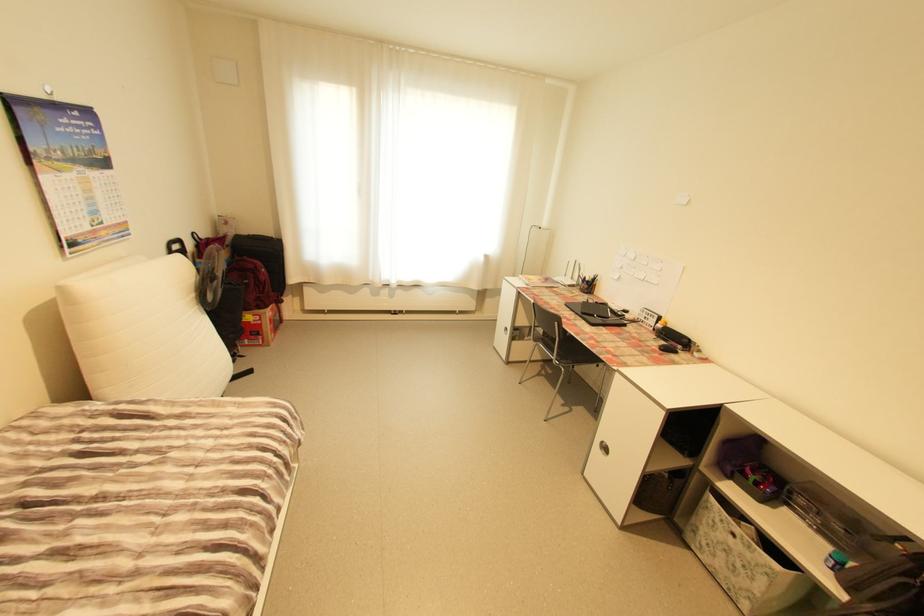
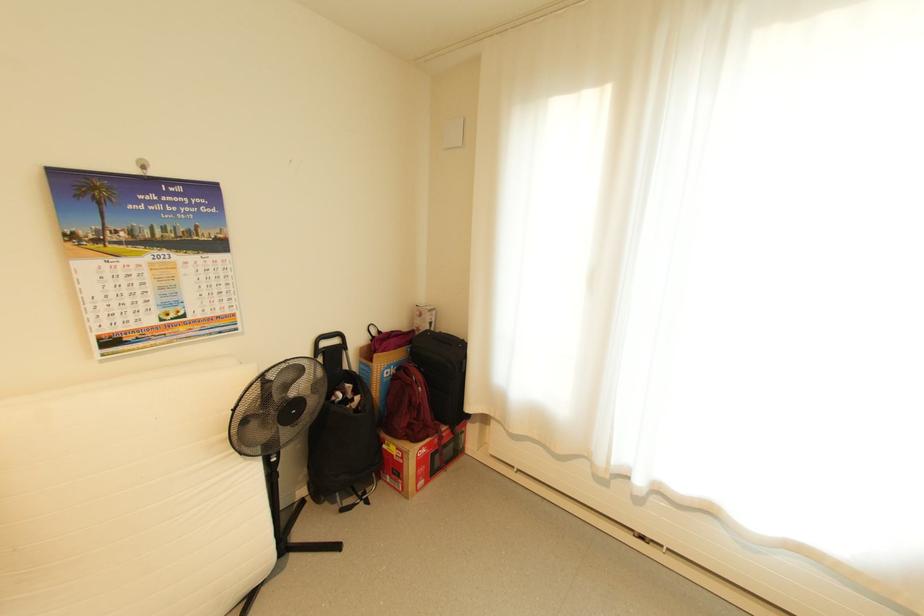
Find the pixel in the second image that matches point 50,97 in the first image.

(140, 172)